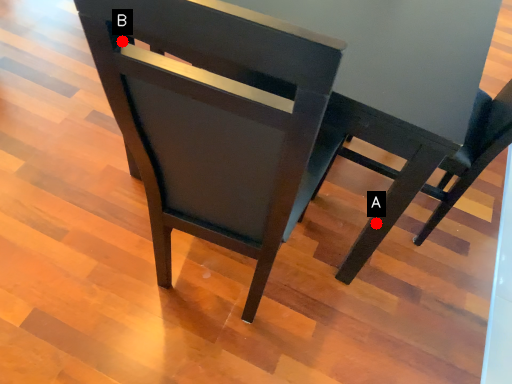
Question: Two points are circled on the image, labeled by A and B beside each circle. Among these points, which one is farthest from the camera?

Choices:
 (A) A is further
 (B) B is further

Answer: (A)